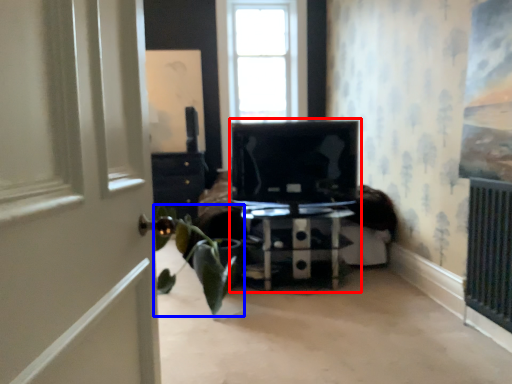
Question: Which of the following is the closest to the observer, entertainment center (highlighted by a red box) or houseplant (highlighted by a blue box)?

Choices:
 (A) entertainment center
 (B) houseplant

Answer: (B)